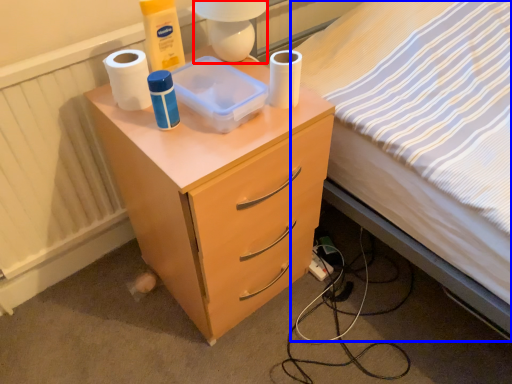
Question: Which of the following is the closest to the observer, lamp (highlighted by a red box) or bed (highlighted by a blue box)?

Choices:
 (A) lamp
 (B) bed

Answer: (B)